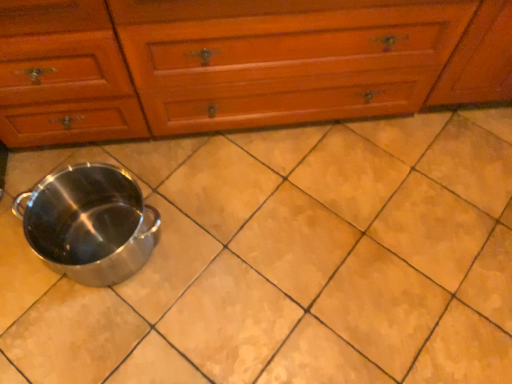
Question: From the image's perspective, is matte ceramic tile at center on top of satin silver crock pot at lower left?

Choices:
 (A) no
 (B) yes

Answer: (A)

Question: From a real-world perspective, does matte ceramic tile at center sit lower than satin silver crock pot at lower left?

Choices:
 (A) no
 (B) yes

Answer: (B)

Question: Is matte ceramic tile at center closer to the viewer compared to satin silver crock pot at lower left?

Choices:
 (A) yes
 (B) no

Answer: (B)

Question: Does matte ceramic tile at center have a greater width compared to satin silver crock pot at lower left?

Choices:
 (A) no
 (B) yes

Answer: (B)

Question: Is matte ceramic tile at center located outside satin silver crock pot at lower left?

Choices:
 (A) no
 (B) yes

Answer: (B)

Question: From the image's perspective, is satin silver crock pot at lower left located above or below matte ceramic tile at center?

Choices:
 (A) above
 (B) below

Answer: (A)

Question: Does point (76, 220) appear closer or farther from the camera than point (263, 319)?

Choices:
 (A) farther
 (B) closer

Answer: (A)

Question: In the image, is satin silver crock pot at lower left positioned in front of or behind matte ceramic tile at center?

Choices:
 (A) front
 (B) behind

Answer: (A)

Question: From a real-world perspective, is satin silver crock pot at lower left physically located above or below matte ceramic tile at center?

Choices:
 (A) above
 (B) below

Answer: (A)

Question: Would you say matte ceramic tile at center is inside or outside satin silver crock pot at lower left?

Choices:
 (A) inside
 (B) outside

Answer: (B)

Question: Is matte ceramic tile at center taller or shorter than satin silver crock pot at lower left?

Choices:
 (A) tall
 (B) short

Answer: (B)

Question: From the image's perspective, relative to satin silver crock pot at lower left, is matte ceramic tile at center above or below?

Choices:
 (A) below
 (B) above

Answer: (A)

Question: Considering the positions of point (162, 316) and point (54, 238), is point (162, 316) closer or farther from the camera than point (54, 238)?

Choices:
 (A) farther
 (B) closer

Answer: (B)

Question: Is matte ceramic tile at center to the left or to the right of wooden chest of drawers at center in the image?

Choices:
 (A) right
 (B) left

Answer: (B)

Question: Do you think matte ceramic tile at center is within wooden chest of drawers at center, or outside of it?

Choices:
 (A) inside
 (B) outside

Answer: (B)